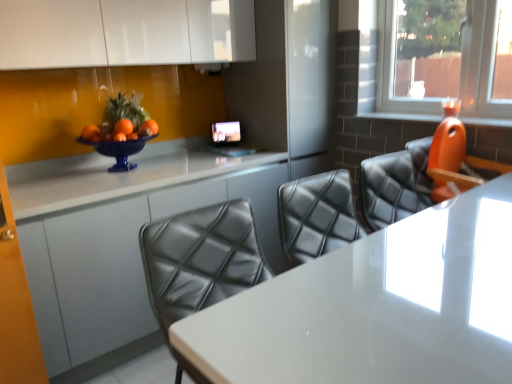
Question: Based on their sizes in the image, would you say white glossy table at center is bigger or smaller than orange plastic chair at right?

Choices:
 (A) small
 (B) big

Answer: (B)

Question: Is white glossy table at center in front of or behind orange plastic chair at right in the image?

Choices:
 (A) behind
 (B) front

Answer: (B)

Question: Estimate the real-world distances between objects in this image. Which object is closer to the white glossy table at center?

Choices:
 (A) white glossy counter at center
 (B) transparent glass candle at upper right
 (C) orange plastic chair at right

Answer: (C)

Question: Which is nearer to the orange plastic chair at right?

Choices:
 (A) transparent glass candle at upper right
 (B) white glossy table at center
 (C) white glossy counter at center

Answer: (B)